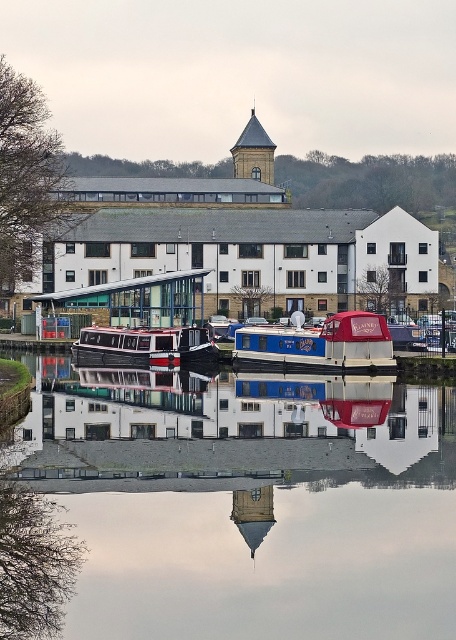
Which is more to the right, metallic glass dock at center or smooth glass tower at center?

From the viewer's perspective, smooth glass tower at center appears more on the right side.

Which is in front, point (123, 324) or point (236, 508)?

Positioned in front is point (236, 508).

Does point (130, 316) lie in front of point (264, 531)?

No, (130, 316) is further to viewer.

Identify the location of metallic glass dock at center. (136, 300).

Where is `transparent glass water at center`? Image resolution: width=456 pixels, height=640 pixels. transparent glass water at center is located at coordinates (249, 490).

Which is more to the right, transparent glass water at center or metallic glass dock at center?

From the viewer's perspective, transparent glass water at center appears more on the right side.

Where is `transparent glass water at center`? transparent glass water at center is located at coordinates point(249,490).

At what (x,y) coordinates should I click in order to perform the action: click on transparent glass water at center. Please return your answer as a coordinate pair (x, y). This screenshot has width=456, height=640. Looking at the image, I should click on (249, 490).

Is the position of transparent glass water at center more distant than that of smooth glass tower at center?

No, transparent glass water at center is closer to the viewer.

Which is in front, point (249, 400) or point (247, 520)?

Point (247, 520) is in front.

Locate an element on the screen. transparent glass water at center is located at coordinates (249, 490).